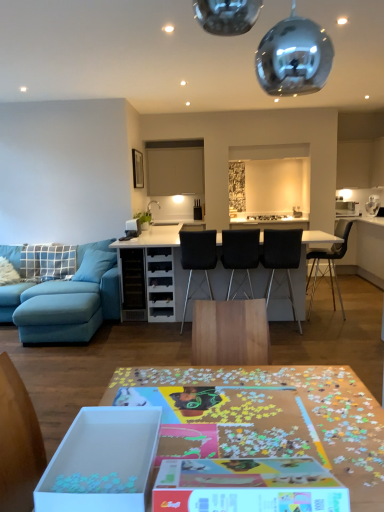
Identify the location of blank space situated above wooden puzzle pieces at center, which is the second table in back-to-front order (from a real-world perspective). The width and height of the screenshot is (384, 512). (245, 413).